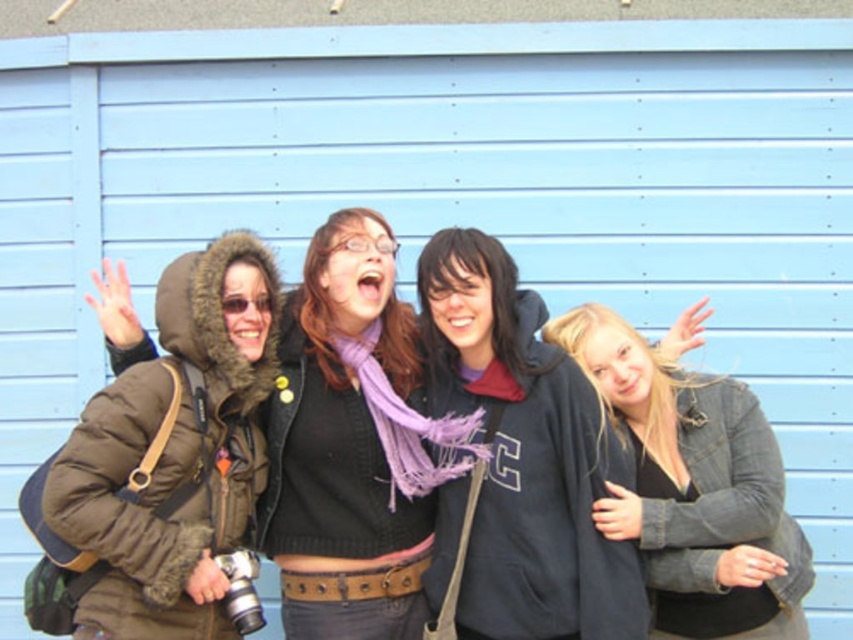
You are standing in front of the group of four people. You notice two points marked in the scene. The first point is at coordinates point (x=97, y=419) and the second point is at point (x=618, y=328). Which of these two points is closer to you?

The point at coordinates point (x=97, y=419) is closer to you than the point at point (x=618, y=328).

You are a photographer trying to capture a group photo. You notice the dark gray hoodie at center and the matte brown jacket at left. Which one should you adjust to ensure both are clearly visible in the frame?

The dark gray hoodie at center is smaller in size compared to the matte brown jacket at left. To ensure both are clearly visible, you should position the matte brown jacket at left closer to the camera since it is larger and might block the smaller dark gray hoodie at center if too close.